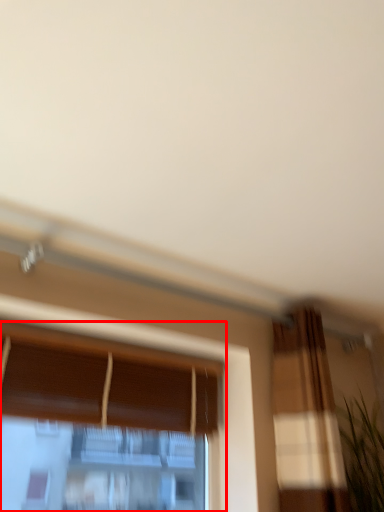
Question: From the image's perspective, where is window (annotated by the red box) located relative to plant?

Choices:
 (A) below
 (B) above

Answer: (B)